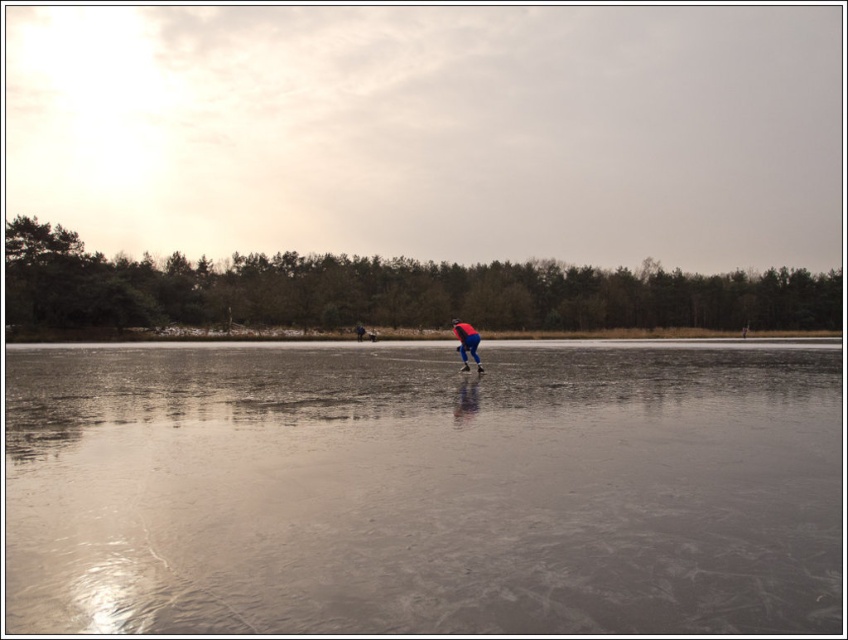
Question: Is the position of transparent ice at center more distant than that of blue fabric pants at center?

Choices:
 (A) yes
 (B) no

Answer: (B)

Question: Among these points, which one is nearest to the camera?

Choices:
 (A) 476,364
 (B) 670,595

Answer: (B)

Question: Can you confirm if transparent ice at center is wider than blue fabric pants at center?

Choices:
 (A) no
 (B) yes

Answer: (B)

Question: From the image, what is the correct spatial relationship of transparent ice at center in relation to blue fabric pants at center?

Choices:
 (A) left
 (B) right

Answer: (A)